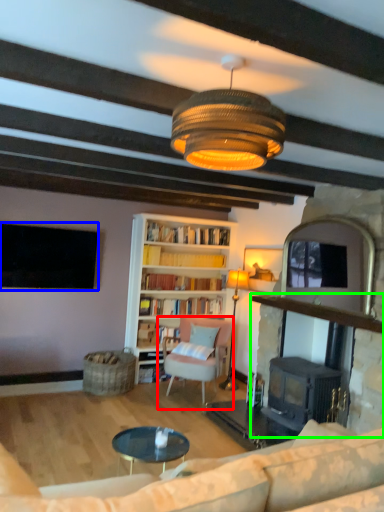
Question: Based on their relative distances, which object is farther from chair (highlighted by a red box)? Choose from television (highlighted by a blue box) and fireplace (highlighted by a green box).

Choices:
 (A) television
 (B) fireplace

Answer: (A)